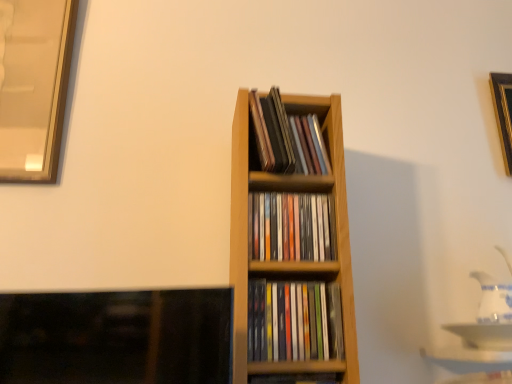
Locate an element on the screen. white glossy tea pot at right is located at coordinates (493, 299).

The image size is (512, 384). What do you see at coordinates (296, 378) in the screenshot?
I see `wooden bookshelf at center, which is the 1th book in bottom-to-top order` at bounding box center [296, 378].

In order to face wooden cd case at center, arranged as the 4th book when ordered from the bottom, should I rotate leftwards or rightwards?

You should look right and rotate roughly 5.833 degrees.

Where is `wooden cd case at center, the 2th book when ordered from top to bottom`? wooden cd case at center, the 2th book when ordered from top to bottom is located at coordinates (291, 227).

Measure the distance between multicolored plastic cds at center, which appears as the second book when ordered from the bottom, and camera.

They are 68.55 centimeters apart.

Where is `white glossy tea pot at right`? This screenshot has height=384, width=512. white glossy tea pot at right is located at coordinates (493, 299).

Is wooden cd case at center, arranged as the 4th book when ordered from the bottom, in front of or behind multicolored plastic cds at center, which appears as the second book when ordered from the bottom, in the image?

In the image, wooden cd case at center, arranged as the 4th book when ordered from the bottom, appears behind multicolored plastic cds at center, which appears as the second book when ordered from the bottom.

Is point (261, 154) positioned after point (287, 316)?

Yes, it is.

In the scene shown: Is wooden cd case at center, which is counted as the 1th book, starting from the top, aimed at multicolored plastic cds at center, the third book viewed from the top?

No.

Which object is thinner, gold metallic picture frame at upper right or wooden cd case at center, arranged as the 4th book when ordered from the bottom?

Thinner between the two is gold metallic picture frame at upper right.

Which object is closer to the camera, gold metallic picture frame at upper right or wooden cd case at center, arranged as the 4th book when ordered from the bottom?

Positioned in front is wooden cd case at center, arranged as the 4th book when ordered from the bottom.

Is gold metallic picture frame at upper right facing away from wooden cd case at center, arranged as the 4th book when ordered from the bottom?

That's not correct — gold metallic picture frame at upper right is not looking away from wooden cd case at center, arranged as the 4th book when ordered from the bottom.

Based on the photo, which is closer, (487, 296) or (250, 103)?

Positioned in front is point (250, 103).

Which of these two, white glossy tea pot at right or wooden cd case at center, arranged as the 4th book when ordered from the bottom, stands shorter?

Standing shorter between the two is wooden cd case at center, arranged as the 4th book when ordered from the bottom.

Is white glossy tea pot at right further to camera compared to wooden cd case at center, arranged as the 4th book when ordered from the bottom?

Yes.

Looking at this image, can you confirm if white glossy tea pot at right is smaller than wooden cd case at center, arranged as the 4th book when ordered from the bottom?

Actually, white glossy tea pot at right might be larger than wooden cd case at center, arranged as the 4th book when ordered from the bottom.

Is gold metallic picture frame at upper right positioned beyond the bounds of wooden bookshelf at center, the fourth book positioned from the top?

Yes, gold metallic picture frame at upper right is outside of wooden bookshelf at center, the fourth book positioned from the top.

How different are the orientations of gold metallic picture frame at upper right and wooden bookshelf at center, which is the 1th book in bottom-to-top order, in degrees?

The angle between the facing direction of gold metallic picture frame at upper right and the facing direction of wooden bookshelf at center, which is the 1th book in bottom-to-top order, is 1.46 degrees.

In the scene shown: From a real-world perspective, which is physically below, gold metallic picture frame at upper right or wooden bookshelf at center, the fourth book positioned from the top?

wooden bookshelf at center, the fourth book positioned from the top, from a real-world perspective.

Considering the positions of objects gold metallic picture frame at upper right and wooden bookshelf at center, which is the 1th book in bottom-to-top order, in the image provided, who is in front, gold metallic picture frame at upper right or wooden bookshelf at center, which is the 1th book in bottom-to-top order,?

wooden bookshelf at center, which is the 1th book in bottom-to-top order.

Is point (308, 116) farther from viewer compared to point (325, 211)?

Yes, it is.

Which of these two, wooden cd case at center, arranged as the 4th book when ordered from the bottom, or wooden cd case at center, the 2th book when ordered from top to bottom, stands taller?

Standing taller between the two is wooden cd case at center, arranged as the 4th book when ordered from the bottom.

Is the position of wooden cd case at center, arranged as the 4th book when ordered from the bottom, more distant than that of wooden cd case at center, which appears as the 3th book when ordered from the bottom?

Yes, it is.

How different are the orientations of wooden cd case at center, which is counted as the 1th book, starting from the top, and wooden cd case at center, the 2th book when ordered from top to bottom, in degrees?

They differ by 0.00227 degrees in their facing directions.

From the image's perspective, would you say white glossy tea pot at right is positioned over multicolored plastic cds at center, the third book viewed from the top?

Yes.

Is white glossy tea pot at right aimed at multicolored plastic cds at center, which appears as the second book when ordered from the bottom?

No.

Does white glossy tea pot at right have a smaller size compared to multicolored plastic cds at center, the third book viewed from the top?

Actually, white glossy tea pot at right might be larger than multicolored plastic cds at center, the third book viewed from the top.

Considering the sizes of white glossy tea pot at right and gold metallic picture frame at upper right in the image, is white glossy tea pot at right bigger or smaller than gold metallic picture frame at upper right?

Clearly, white glossy tea pot at right is larger in size than gold metallic picture frame at upper right.

In the image, is white glossy tea pot at right positioned in front of or behind gold metallic picture frame at upper right?

Visually, white glossy tea pot at right is located in front of gold metallic picture frame at upper right.

Choose the correct answer: Is white glossy tea pot at right inside gold metallic picture frame at upper right or outside it?

white glossy tea pot at right is not enclosed by gold metallic picture frame at upper right.

From the wooden cd case at center, which is counted as the 1th book, starting from the top, count 2nd books forward and point to it. Please provide its 2D coordinates.

[(294, 321)]

Image resolution: width=512 pixels, height=384 pixels. What are the coordinates of `book that is the 1st one below the gold metallic picture frame at upper right (from a real-world perspective)` in the screenshot? It's located at (286, 137).

Estimate the real-world distances between objects in this image. Which object is closer to wooden cd case at center, the 2th book when ordered from top to bottom, wooden bookshelf at center, the fourth book positioned from the top, or wooden cd case at center, arranged as the 4th book when ordered from the bottom?

wooden cd case at center, arranged as the 4th book when ordered from the bottom, is closer to wooden cd case at center, the 2th book when ordered from top to bottom.

From the image, which object appears to be farther from white glossy tea pot at right, multicolored plastic cds at center, which appears as the second book when ordered from the bottom, or wooden cd case at center, which is counted as the 1th book, starting from the top?

wooden cd case at center, which is counted as the 1th book, starting from the top.

Looking at the image, which one is located further to white glossy tea pot at right, wooden cd case at center, arranged as the 4th book when ordered from the bottom, or multicolored plastic cds at center, the third book viewed from the top?

wooden cd case at center, arranged as the 4th book when ordered from the bottom, is further to white glossy tea pot at right.

Which object lies nearer to the anchor point wooden cd case at center, arranged as the 4th book when ordered from the bottom, gold metallic picture frame at upper right or multicolored plastic cds at center, which appears as the second book when ordered from the bottom?

Based on the image, multicolored plastic cds at center, which appears as the second book when ordered from the bottom, appears to be nearer to wooden cd case at center, arranged as the 4th book when ordered from the bottom.

Considering their positions, is gold metallic picture frame at upper right positioned further to white glossy tea pot at right than wooden cd case at center, the 2th book when ordered from top to bottom?

wooden cd case at center, the 2th book when ordered from top to bottom, is further to white glossy tea pot at right.

When comparing their distances from wooden cd case at center, which is counted as the 1th book, starting from the top, does gold metallic picture frame at upper right or wooden cd case at center, the 2th book when ordered from top to bottom, seem further?

gold metallic picture frame at upper right.

Considering their positions, is multicolored plastic cds at center, the third book viewed from the top, positioned closer to wooden cd case at center, which appears as the 3th book when ordered from the bottom, than wooden cd case at center, which is counted as the 1th book, starting from the top?

Based on the image, multicolored plastic cds at center, the third book viewed from the top, appears to be nearer to wooden cd case at center, which appears as the 3th book when ordered from the bottom.

From the image, which object appears to be farther from wooden cd case at center, which is counted as the 1th book, starting from the top, gold metallic picture frame at upper right or white glossy tea pot at right?

The object further to wooden cd case at center, which is counted as the 1th book, starting from the top, is gold metallic picture frame at upper right.

At what (x,y) coordinates should I click in order to perform the action: click on book between wooden cd case at center, arranged as the 4th book when ordered from the bottom, and multicolored plastic cds at center, the third book viewed from the top, from top to bottom. Please return your answer as a coordinate pair (x, y). Image resolution: width=512 pixels, height=384 pixels. Looking at the image, I should click on (291, 227).

This screenshot has width=512, height=384. I want to click on book between wooden bookshelf at center, the fourth book positioned from the top, and white glossy tea pot at right, in the horizontal direction, so click(x=286, y=137).

Where is `tea pot between multicolored plastic cds at center, which appears as the second book when ordered from the bottom, and gold metallic picture frame at upper right`? tea pot between multicolored plastic cds at center, which appears as the second book when ordered from the bottom, and gold metallic picture frame at upper right is located at coordinates (493, 299).

At what (x,y) coordinates should I click in order to perform the action: click on tea pot between wooden cd case at center, arranged as the 4th book when ordered from the bottom, and gold metallic picture frame at upper right from left to right. Please return your answer as a coordinate pair (x, y). Looking at the image, I should click on (493, 299).